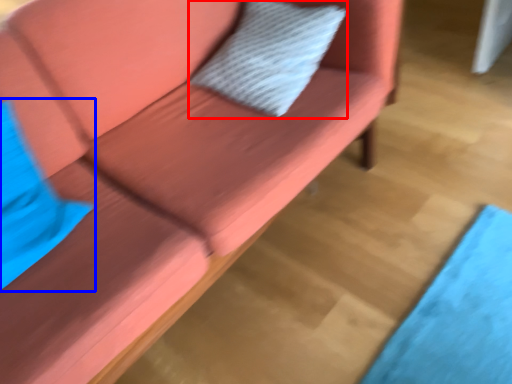
Question: Which object appears farthest to the camera in this image, pillow (highlighted by a red box) or pillow (highlighted by a blue box)?

Choices:
 (A) pillow
 (B) pillow

Answer: (A)